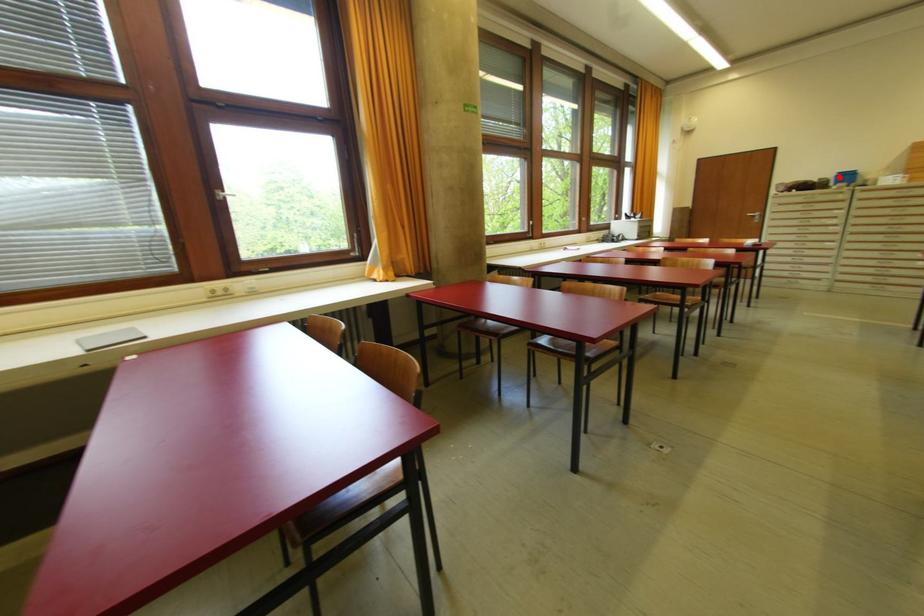
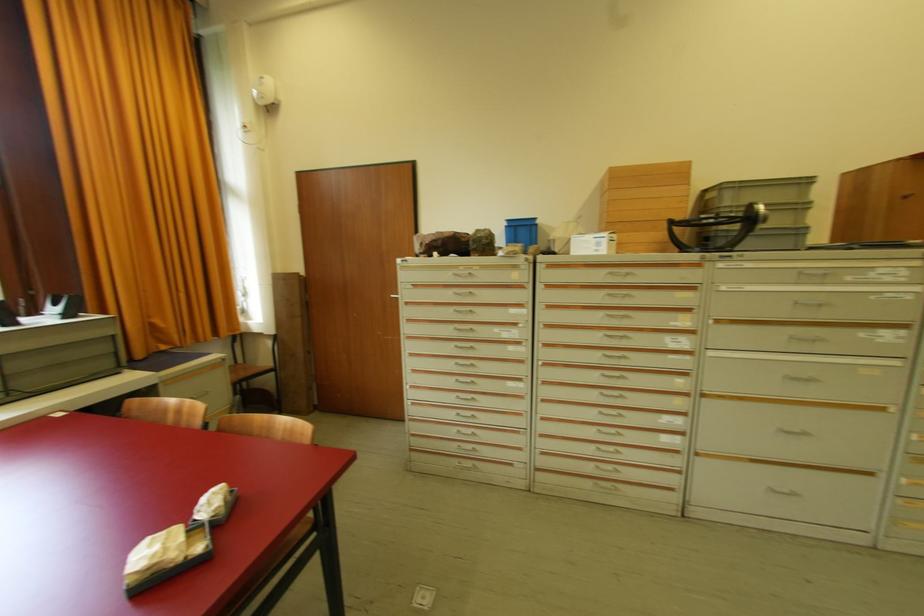
Question: I am providing you with two images of the same scene from different viewpoints. In image1, a red point is highlighted. Considering the same 3D point in image2, which of the following is correct?

Choices:
 (A) It is closer
 (B) It is farther

Answer: (A)